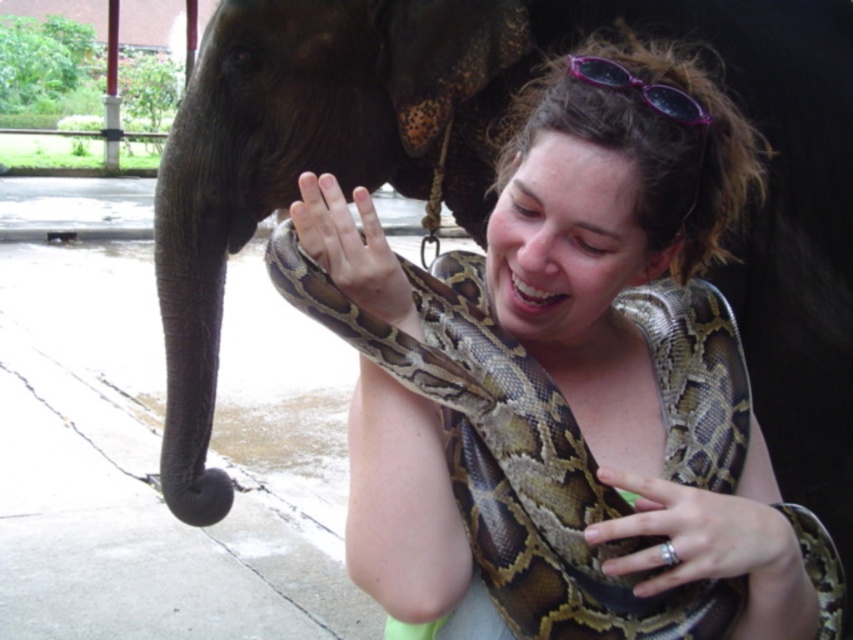
What do you see at coordinates (509, 458) in the screenshot? I see `brown patterned snake at center` at bounding box center [509, 458].

Based on the photo, is brown patterned snake at center taller than brown textured snake at center?

Yes, brown patterned snake at center is taller than brown textured snake at center.

Between point (289, 272) and point (593, 317), which one is positioned in front?

Point (289, 272)

The width and height of the screenshot is (853, 640). Find the location of `brown patterned snake at center`. brown patterned snake at center is located at coordinates (509, 458).

Is point (544, 544) positioned after point (679, 120)?

Yes, it is behind point (679, 120).

The image size is (853, 640). Find the location of `brown patterned snake at center`. brown patterned snake at center is located at coordinates (509, 458).

Is point (477, 570) behind point (595, 83)?

Yes, it is behind point (595, 83).

The height and width of the screenshot is (640, 853). What are the coordinates of `brown patterned snake at center` in the screenshot? It's located at (509, 458).

Can you confirm if brown textured snake at center is wider than purple plastic goggles at upper center?

Yes, brown textured snake at center is wider than purple plastic goggles at upper center.

Which is above, brown textured snake at center or purple plastic goggles at upper center?

purple plastic goggles at upper center is above.

Is point (618, 326) farther from camera compared to point (653, 93)?

Yes, point (618, 326) is farther from viewer.

Locate an element on the screen. brown textured snake at center is located at coordinates (582, 342).